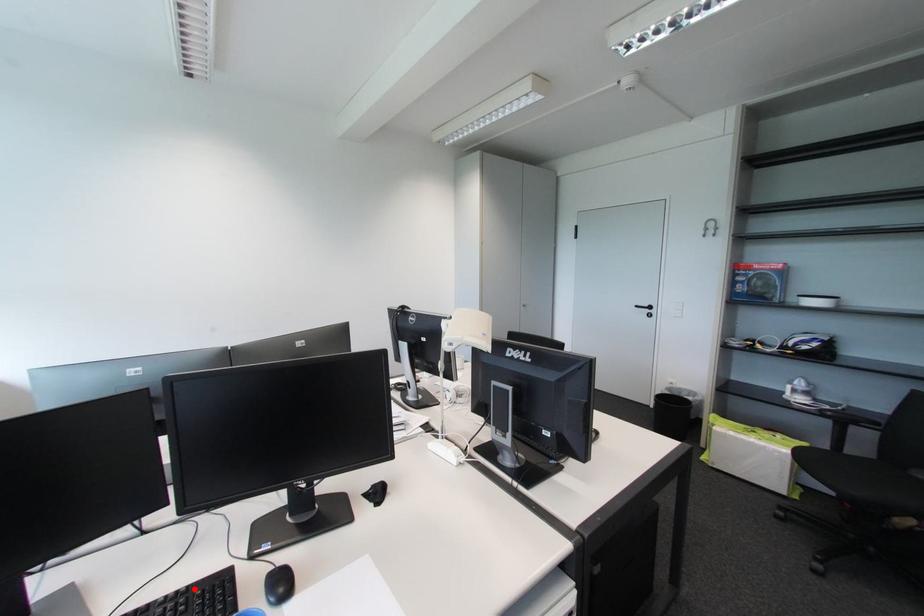
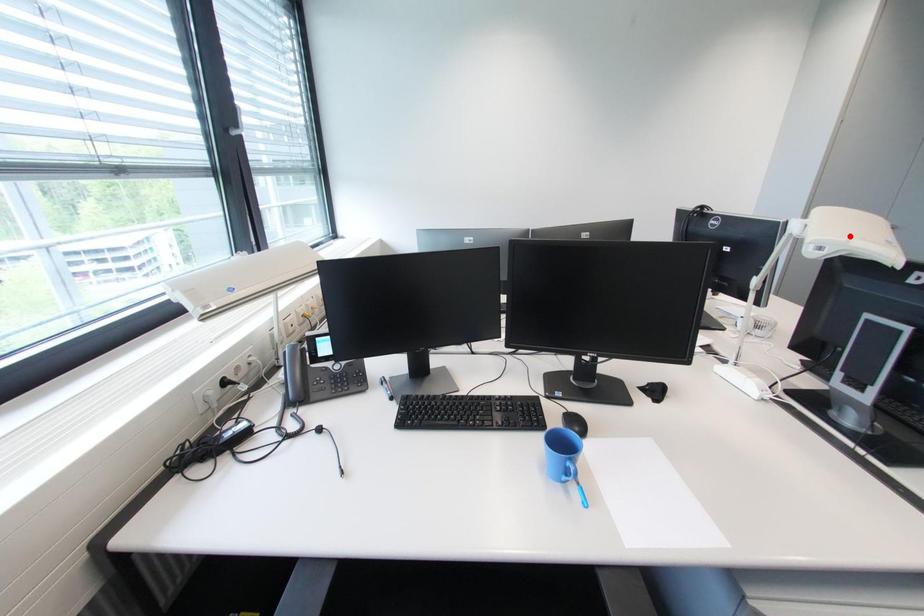
I am providing you with two images of the same scene from different viewpoints. A red point is marked on the first image and another point is marked on the second image. Do the highlighted points in image1 and image2 indicate the same real-world spot?

No